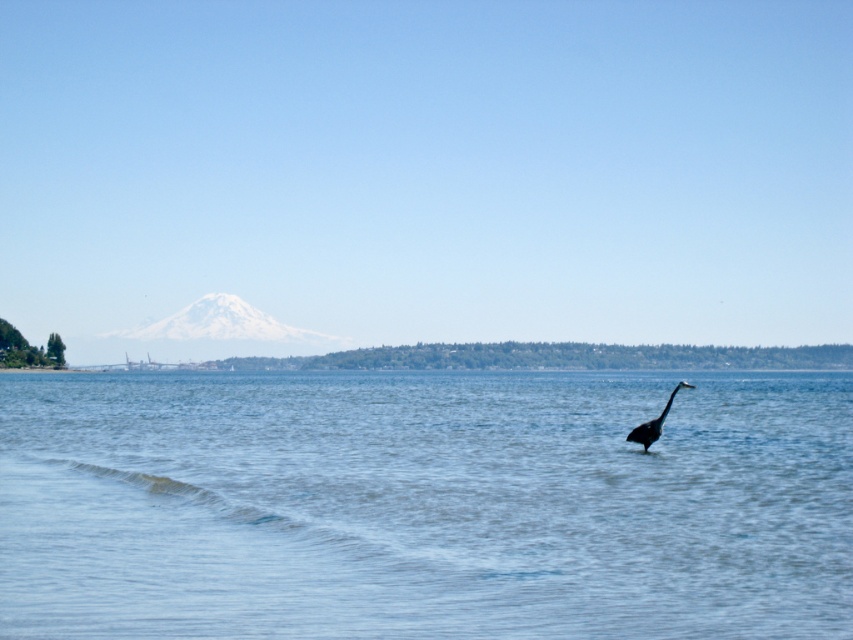
Does point (676, 435) come in front of point (627, 440)?

No, (676, 435) is further to viewer.

Who is positioned more to the right, clear blue water at center or gray matte bird at center?

clear blue water at center

Identify the location of clear blue water at center. (424, 506).